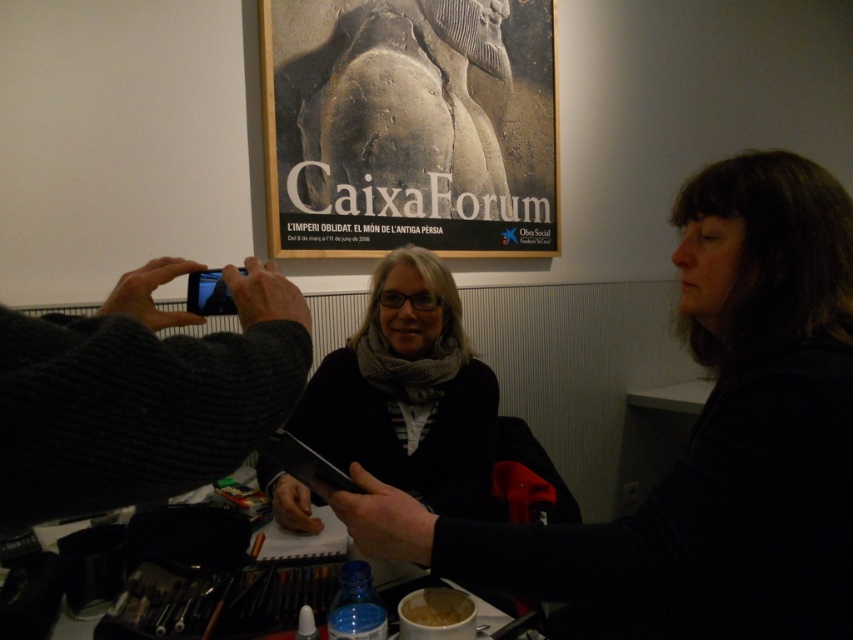
You are standing in the art gallery and want to take a photo of the dark gray sweater at center. Where should you position yourself to ensure the point at (705, 442) is in the frame?

Position yourself so that the point at (705, 442) on the dark gray sweater at center is within your camera or phone viewfinder. Since the point is located on the sweater itself, aligning the camera to capture the sweater will naturally include the specified coordinate.

You are an art student visiting the exhibition at CaixaForum. You want to take a photo of the knitted dark gray sweater at left and the wooden frame at upper center for your sketchbook reference. Which object should you position to the right side in your camera viewfinder to include both properly?

You should position the wooden frame at upper center to the right side in your camera viewfinder since it is already located to the right of the knitted dark gray sweater at left.